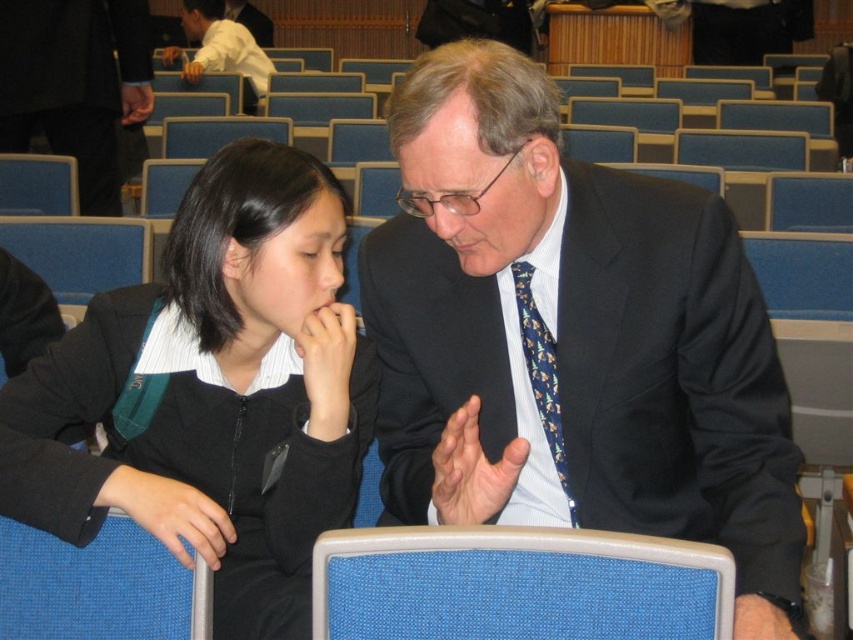
Please provide the coordinates of the matte black suit at center in the image using the coordinate system where the bottom left corner is the origin point.

The coordinates of the matte black suit at center are at point (572,339).

Consider the image. You are organizing a small event and need to place a decorative pillow on the seat of the blue fabric chair at lower center. The pillow you have is the same size as the black fabric jacket at left. Will the pillow fit on the chair?

The black fabric jacket at left is bigger than the blue fabric chair at lower center. Since the pillow is the same size as the jacket, it will not fit on the chair.